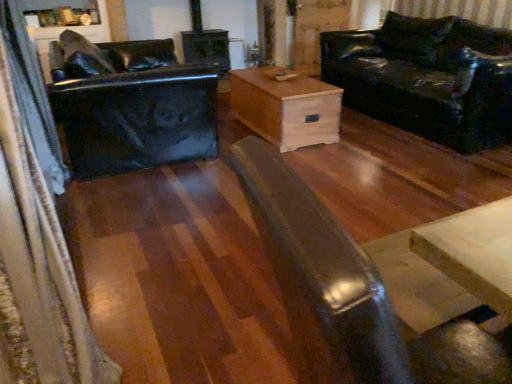
You are a GUI agent. You are given a task and a screenshot of the screen. Output one action in this format:
    pyautogui.click(x=<x>, y=<y>)
    Task: Click on the natural wood chest at center
    The width and height of the screenshot is (512, 384).
    Given the screenshot: What is the action you would take?
    pyautogui.click(x=286, y=107)

What do you see at coordinates (36, 234) in the screenshot?
I see `velvet dark blue curtain at left` at bounding box center [36, 234].

What do you see at coordinates (426, 78) in the screenshot?
I see `shiny black leather couch at right` at bounding box center [426, 78].

Measure the distance between point [446,71] and camera.

Point [446,71] and camera are 11.83 feet apart.

Identify the location of glossy black swivel chair at left. This screenshot has height=384, width=512. tap(131, 105).

Does natural wood chest at center turn towards glossy black swivel chair at left?

Yes, natural wood chest at center is oriented towards glossy black swivel chair at left.

At what (x,y) coordinates should I click in order to perform the action: click on table below the glossy black swivel chair at left (from the image's perspective). Please return your answer as a coordinate pair (x, y). The image size is (512, 384). Looking at the image, I should click on (286, 107).

From a real-world perspective, is natural wood chest at center on top of glossy black swivel chair at left?

No, from a real-world perspective, natural wood chest at center is not on top of glossy black swivel chair at left.

Looking at the image, does natural wood chest at center seem bigger or smaller compared to glossy black swivel chair at left?

natural wood chest at center is smaller than glossy black swivel chair at left.

Which of these two, velvet dark blue curtain at left or glossy black swivel chair at left, is smaller?

velvet dark blue curtain at left is smaller.

From a real-world perspective, is velvet dark blue curtain at left positioned under glossy black swivel chair at left based on gravity?

Incorrect, from a real-world perspective, velvet dark blue curtain at left is higher than glossy black swivel chair at left.

Based on the photo, is velvet dark blue curtain at left not close to glossy black swivel chair at left?

No, velvet dark blue curtain at left is not far away from glossy black swivel chair at left.

How many degrees apart are the facing directions of velvet dark blue curtain at left and glossy black swivel chair at left?

They differ by 0.586 degrees in their facing directions.

The height and width of the screenshot is (384, 512). I want to click on table behind the matte black coffee table at center, so click(286, 107).

Considering the relative sizes of matte black coffee table at center and natural wood chest at center in the image provided, is matte black coffee table at center smaller than natural wood chest at center?

Actually, matte black coffee table at center might be larger than natural wood chest at center.

From a real-world perspective, between matte black coffee table at center and natural wood chest at center, who is vertically lower?

natural wood chest at center is physically lower.

Considering the positions of objects shiny black leather couch at right and glossy black swivel chair at left in the image provided, who is in front, shiny black leather couch at right or glossy black swivel chair at left?

glossy black swivel chair at left is in front.

Is glossy black swivel chair at left located within shiny black leather couch at right?

No, glossy black swivel chair at left is not surrounded by shiny black leather couch at right.

From the image's perspective, is shiny black leather couch at right on glossy black swivel chair at left?

Yes, from the image's perspective, shiny black leather couch at right is over glossy black swivel chair at left.

Considering the sizes of shiny black leather couch at right and glossy black swivel chair at left in the image, is shiny black leather couch at right bigger or smaller than glossy black swivel chair at left?

In the image, shiny black leather couch at right appears to be larger than glossy black swivel chair at left.

From a real-world perspective, is matte black coffee table at center beneath glossy black swivel chair at left?

No.

Which of these two, matte black coffee table at center or glossy black swivel chair at left, stands taller?

matte black coffee table at center.

From the picture: Would you say matte black coffee table at center is to the left or to the right of glossy black swivel chair at left in the picture?

matte black coffee table at center is positioned on glossy black swivel chair at left's right side.

Is matte black coffee table at center not inside glossy black swivel chair at left?

Yes, matte black coffee table at center is outside of glossy black swivel chair at left.

From the picture: Is shiny black leather couch at right positioned with its back to matte black coffee table at center?

No, shiny black leather couch at right is not facing away from matte black coffee table at center.

Is shiny black leather couch at right located outside matte black coffee table at center?

Yes, shiny black leather couch at right is not within matte black coffee table at center.

Are shiny black leather couch at right and matte black coffee table at center far apart?

shiny black leather couch at right is positioned a significant distance from matte black coffee table at center.

Which of these two, shiny black leather couch at right or matte black coffee table at center, is smaller?

matte black coffee table at center.

Does point (274, 129) lie behind point (317, 219)?

Yes, point (274, 129) is behind point (317, 219).

From the picture: Considering the sizes of objects natural wood chest at center and matte black coffee table at center in the image provided, who is thinner, natural wood chest at center or matte black coffee table at center?

With smaller width is natural wood chest at center.

Looking at this image, from the image's perspective, would you say natural wood chest at center is positioned over matte black coffee table at center?

Indeed, from the image's perspective, natural wood chest at center is shown above matte black coffee table at center.

The height and width of the screenshot is (384, 512). I want to click on swivel chair that appears above the natural wood chest at center (from a real-world perspective), so click(131, 105).

This screenshot has width=512, height=384. I want to click on curtain in front of the glossy black swivel chair at left, so click(36, 234).

Based on their spatial positions, is glossy black swivel chair at left or shiny black leather couch at right closer to velvet dark blue curtain at left?

glossy black swivel chair at left lies closer to velvet dark blue curtain at left than the other object.

When comparing their distances from matte black coffee table at center, does natural wood chest at center or shiny black leather couch at right seem closer?

Among the two, natural wood chest at center is located nearer to matte black coffee table at center.

Estimate the real-world distances between objects in this image. Which object is further from natural wood chest at center, shiny black leather couch at right or velvet dark blue curtain at left?

velvet dark blue curtain at left is positioned further to the anchor natural wood chest at center.

Looking at the image, which one is located further to velvet dark blue curtain at left, glossy black swivel chair at left or matte black coffee table at center?

matte black coffee table at center lies further to velvet dark blue curtain at left than the other object.

Looking at the image, which one is located closer to velvet dark blue curtain at left, shiny black leather couch at right or matte black coffee table at center?

matte black coffee table at center lies closer to velvet dark blue curtain at left than the other object.

Looking at the image, which one is located further to matte black coffee table at center, velvet dark blue curtain at left or shiny black leather couch at right?

Among the two, shiny black leather couch at right is located further to matte black coffee table at center.

Estimate the real-world distances between objects in this image. Which object is further from matte black coffee table at center, velvet dark blue curtain at left or glossy black swivel chair at left?

glossy black swivel chair at left is positioned further to the anchor matte black coffee table at center.

When comparing their distances from matte black coffee table at center, does shiny black leather couch at right or glossy black swivel chair at left seem closer?

Based on the image, glossy black swivel chair at left appears to be nearer to matte black coffee table at center.

Image resolution: width=512 pixels, height=384 pixels. I want to click on swivel chair between matte black coffee table at center and natural wood chest at center from front to back, so click(x=131, y=105).

Identify the location of swivel chair between matte black coffee table at center and shiny black leather couch at right along the z-axis. This screenshot has height=384, width=512. (131, 105).

At what (x,y) coordinates should I click in order to perform the action: click on curtain between matte black coffee table at center and glossy black swivel chair at left from front to back. Please return your answer as a coordinate pair (x, y). The height and width of the screenshot is (384, 512). Looking at the image, I should click on (36, 234).

Locate an element on the screen. The width and height of the screenshot is (512, 384). curtain between matte black coffee table at center and natural wood chest at center in the front-back direction is located at coordinates (36, 234).